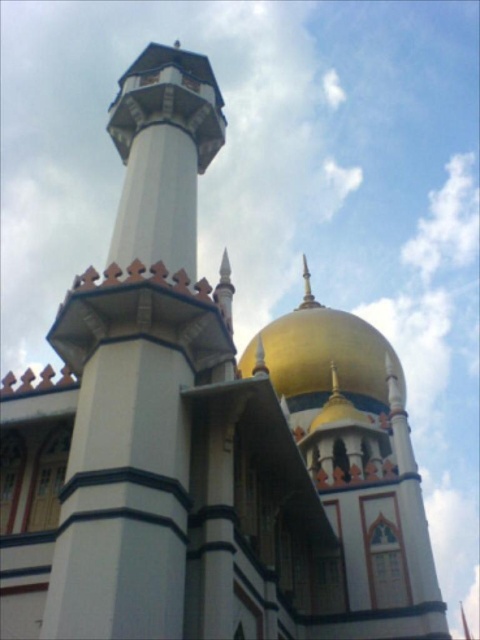
Is gold shiny dome at upper center below white stone minaret at upper left?

Correct, gold shiny dome at upper center is located below white stone minaret at upper left.

Does gold shiny dome at upper center have a lesser width compared to white stone minaret at upper left?

In fact, gold shiny dome at upper center might be wider than white stone minaret at upper left.

Which is in front, point (427, 545) or point (145, 81)?

Point (427, 545)

Locate an element on the screen. This screenshot has width=480, height=640. gold shiny dome at upper center is located at coordinates (355, 461).